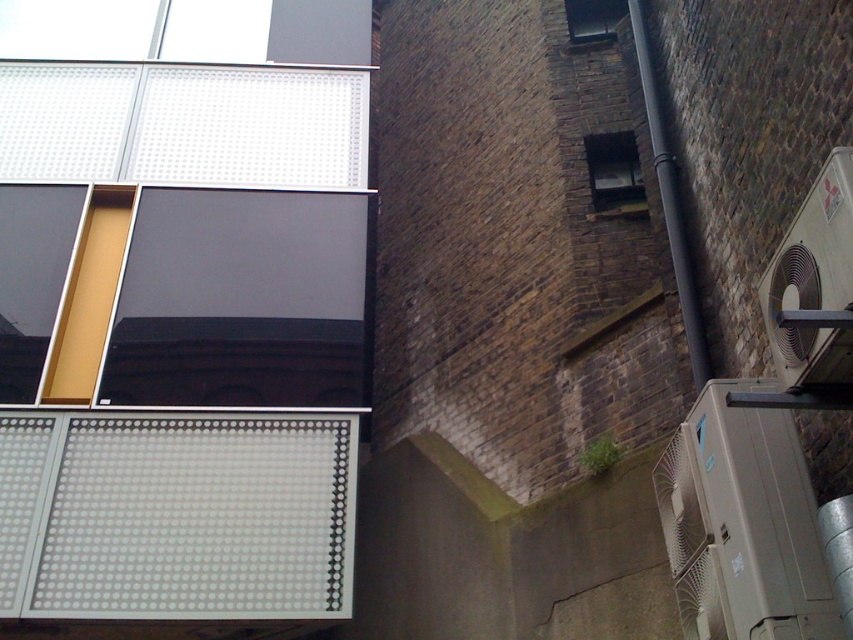
You are an architect evaluating the facade of a building. You notice the clear glass window at upper right and the matte black window at upper center. Which window has a smaller width?

The clear glass window at upper right has a lesser width compared to the matte black window at upper center, so the clear glass window at upper right is smaller in width.

From the picture: You are standing in front of the two buildings and want to determine which point is nearer to you. The points are labeled as point 1 at coordinates point (631, 157) and point 2 at coordinates point (625, 0). Based on the scene, which point is closer to you?

Point 1 at coordinates point (631, 157) is closer to you because it is described as being closer to the viewer than point 2 at coordinates point (625, 0).